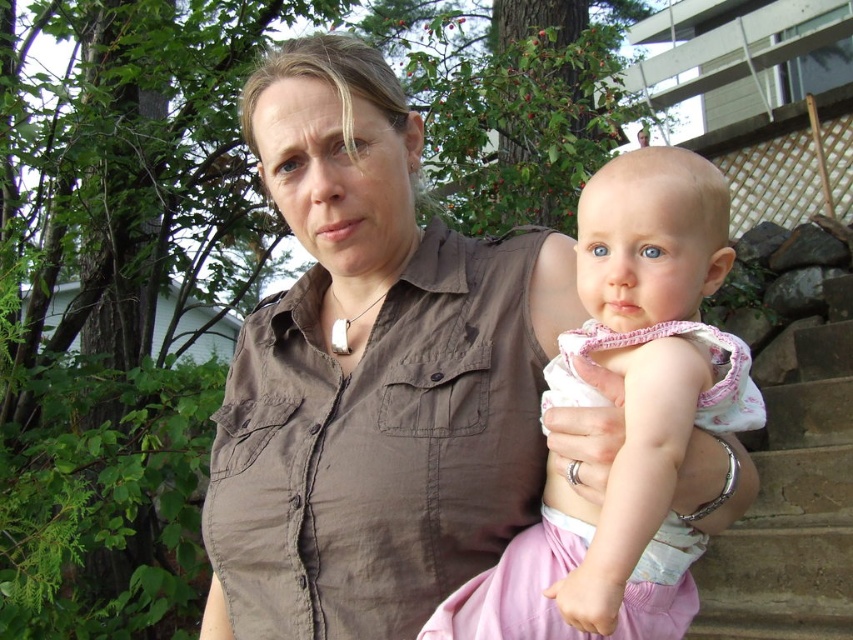
Can you confirm if brown cotton shirt at center is smaller than brown stone stairs at lower right?

Indeed, brown cotton shirt at center has a smaller size compared to brown stone stairs at lower right.

Based on the photo, who is positioned more to the left, brown cotton shirt at center or brown stone stairs at lower right?

brown cotton shirt at center

Is point (367, 529) positioned before point (766, 524)?

Yes.

Identify the location of brown cotton shirt at center. (372, 374).

Is brown cotton shirt at center below pink fabric at center?

Incorrect, brown cotton shirt at center is not positioned below pink fabric at center.

Which is behind, point (405, 220) or point (657, 497)?

The point (405, 220) is more distant.

Based on the photo, who is more distant from viewer, (396, 412) or (602, 508)?

The point (396, 412) is more distant.

Locate an element on the screen. This screenshot has height=640, width=853. brown cotton shirt at center is located at coordinates (372, 374).

From the picture: Which of these two, brown stone stairs at lower right or pink fabric at center, stands taller?

brown stone stairs at lower right

Does brown stone stairs at lower right have a greater width compared to pink fabric at center?

Yes.

In order to click on brown stone stairs at lower right in this screenshot , I will do `click(792, 497)`.

Locate an element on the screen. The image size is (853, 640). brown stone stairs at lower right is located at coordinates (792, 497).